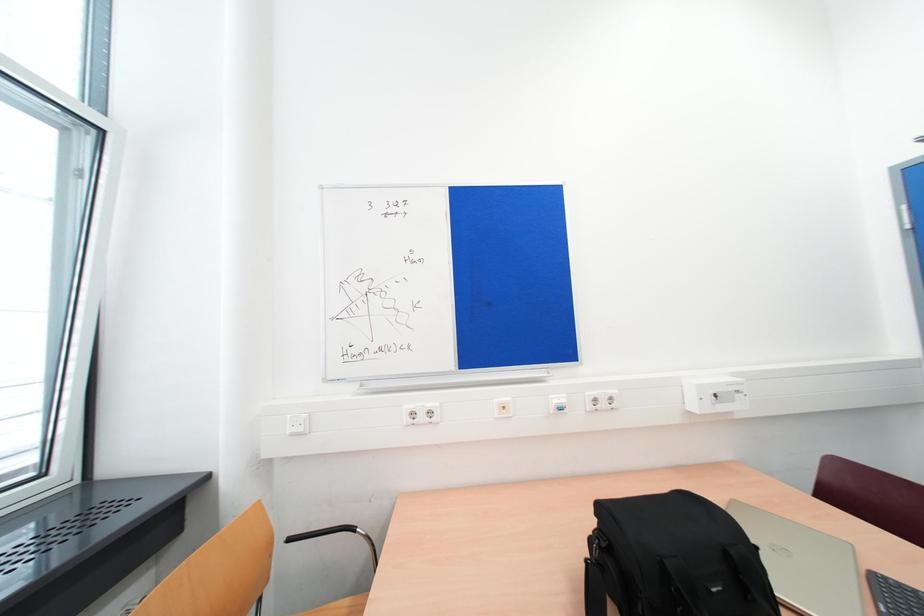
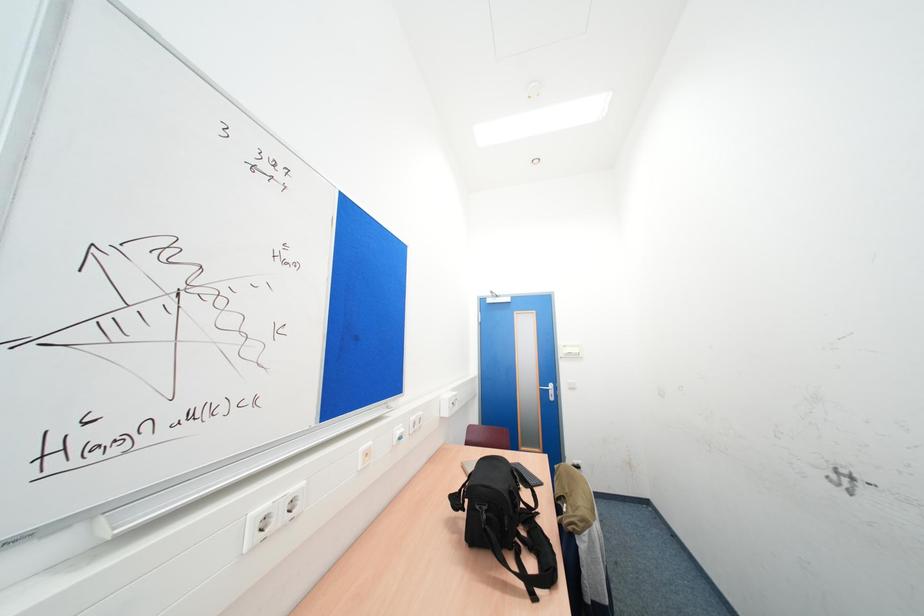
Question: The camera is either moving clockwise (left) or counter-clockwise (right) around the object. The first image is from the beginning of the video and the second image is from the end. Is the camera moving left or right when shooting the video?

Choices:
 (A) Left
 (B) Right

Answer: (A)